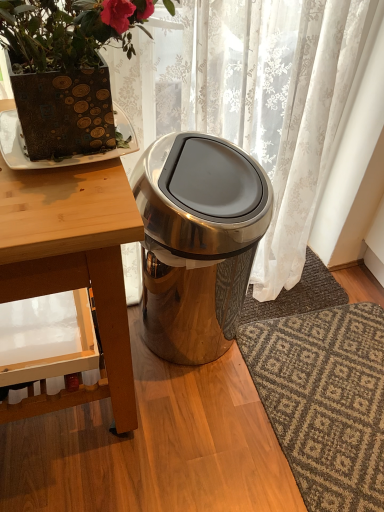
Question: From the image's perspective, is brown textured rug at lower right, the first doormat positioned from the bottom, located above or below satin silver trash can at center?

Choices:
 (A) above
 (B) below

Answer: (B)

Question: In terms of width, does brown textured rug at lower right, the first doormat positioned from the bottom, look wider or thinner when compared to satin silver trash can at center?

Choices:
 (A) thin
 (B) wide

Answer: (B)

Question: Based on their relative distances, which object is nearer to the brown textured rug at lower right, the first doormat positioned from the bottom?

Choices:
 (A) brown textured plate at upper left
 (B) wooden table at left
 (C) satin silver trash can at center
 (D) matte brown pot at upper left
 (E) dark gray textured rug at lower right, the first doormat when ordered from top to bottom

Answer: (E)

Question: Based on their relative distances, which object is nearer to the brown textured rug at lower right, placed as the 2th doormat when sorted from top to bottom?

Choices:
 (A) matte brown pot at upper left
 (B) wooden table at left
 (C) dark gray textured rug at lower right, the first doormat when ordered from top to bottom
 (D) satin silver trash can at center
 (E) brown textured plate at upper left

Answer: (C)